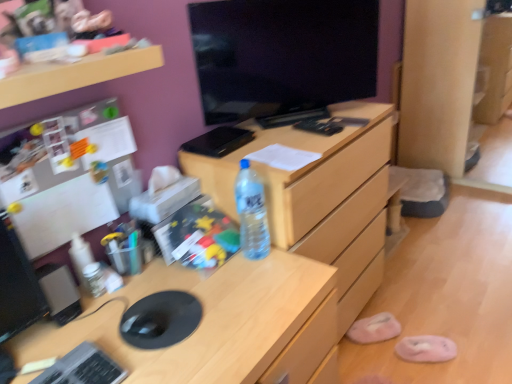
Identify the location of vacant region above wooden desk at center (from a real-world perspective). (141, 311).